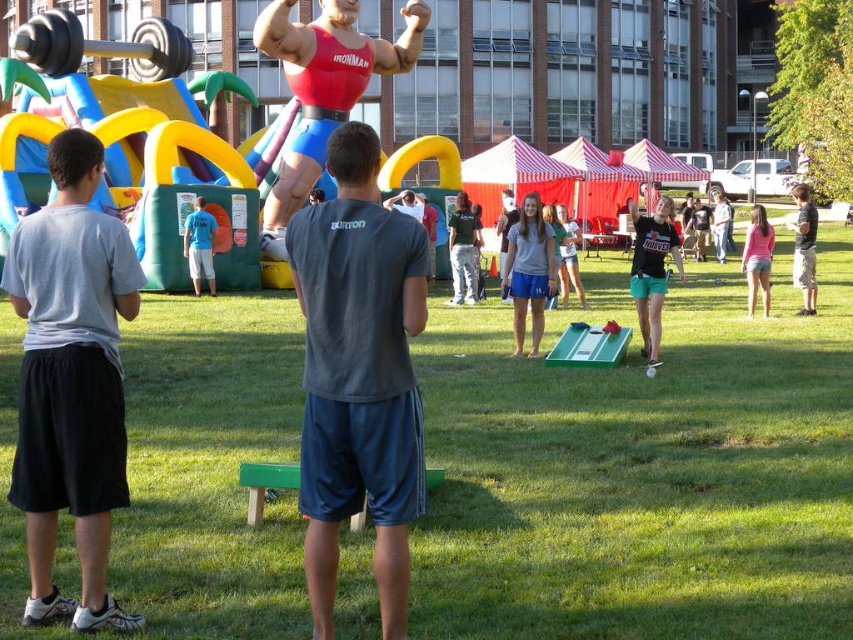
Can you confirm if gray cotton shirt at center is shorter than black cotton shirt at right?

Indeed, gray cotton shirt at center has a lesser height compared to black cotton shirt at right.

Which of these two, gray cotton shirt at center or black cotton shirt at right, stands taller?

With more height is black cotton shirt at right.

This screenshot has width=853, height=640. What do you see at coordinates (529, 269) in the screenshot?
I see `gray cotton shirt at center` at bounding box center [529, 269].

The image size is (853, 640). Identify the location of gray cotton shirt at center. (x=529, y=269).

Which of these two, rubber mannequin at center or green jersey at center, stands taller?

With more height is rubber mannequin at center.

In the scene shown: Does rubber mannequin at center have a lesser height compared to green jersey at center?

No.

Is point (369, 76) positioned after point (453, 276)?

That is True.

The image size is (853, 640). In order to click on rubber mannequin at center in this screenshot , I will do `click(323, 90)`.

Which is more to the right, black matte shirt at center or green jersey at center?

Positioned to the right is black matte shirt at center.

Identify the location of black matte shirt at center. (653, 272).